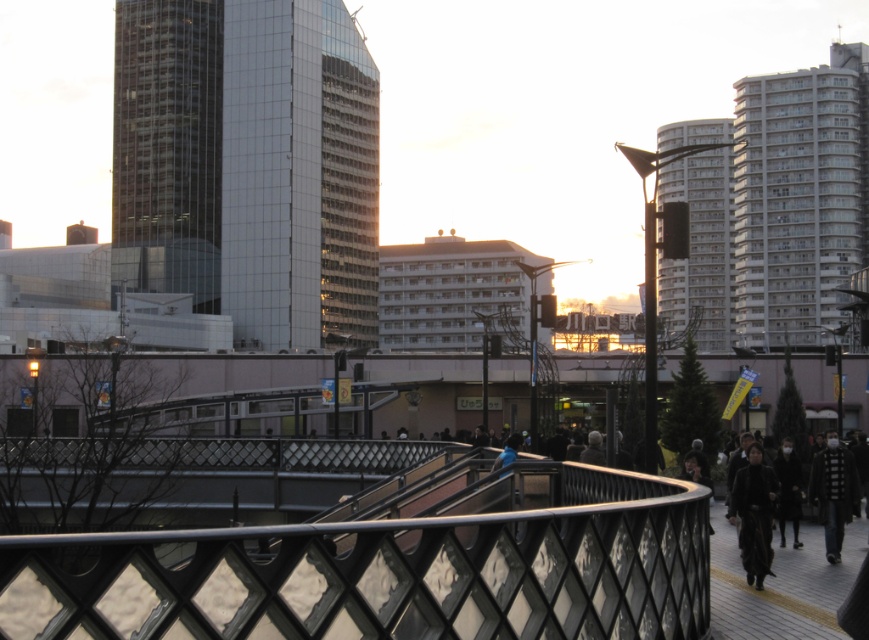
Is point (839, 515) farther from viewer compared to point (501, 458)?

No.

Where is `black textured jacket at lower right`? black textured jacket at lower right is located at coordinates (833, 492).

Is metallic mesh bridge at center shorter than black matte coat at lower right?

In fact, metallic mesh bridge at center may be taller than black matte coat at lower right.

Is metallic mesh bridge at center behind black matte coat at lower right?

No, metallic mesh bridge at center is closer to the viewer.

Between point (71, 540) and point (788, 486), which one is positioned behind?

Point (788, 486)

Where is `metallic mesh bridge at center`? The width and height of the screenshot is (869, 640). metallic mesh bridge at center is located at coordinates (390, 570).

Locate an element on the screen. black fur coat at lower right is located at coordinates (754, 515).

Locate an element on the screen. The image size is (869, 640). black fur coat at lower right is located at coordinates (754, 515).